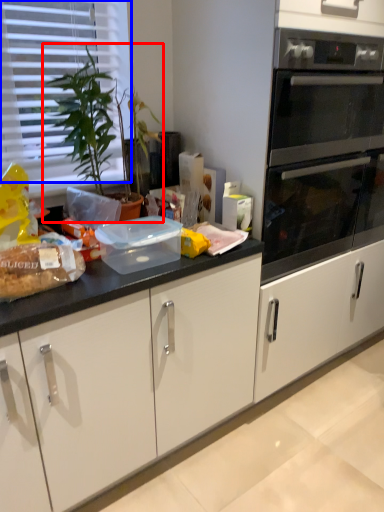
Question: Which of the following is the farthest to the observer, houseplant (highlighted by a red box) or blind (highlighted by a blue box)?

Choices:
 (A) houseplant
 (B) blind

Answer: (B)